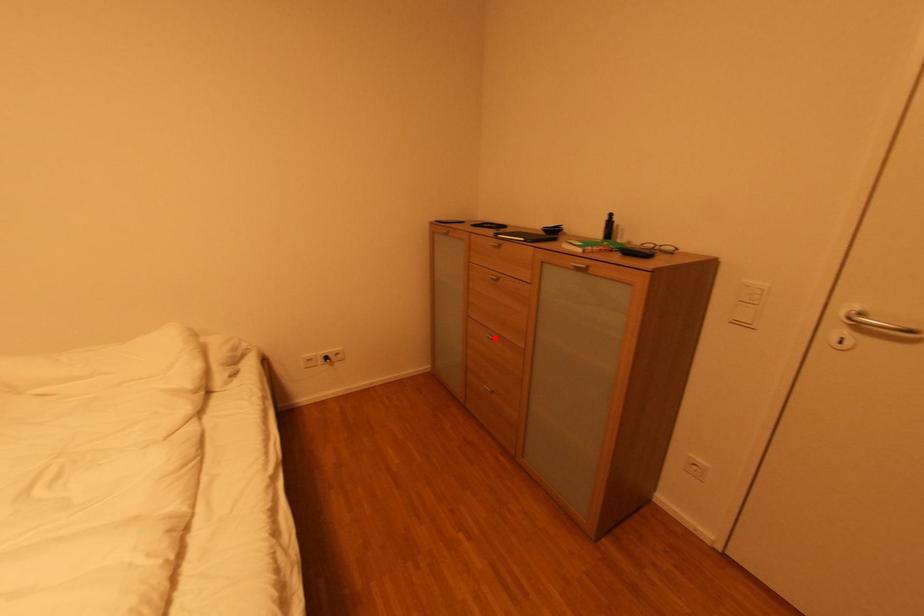
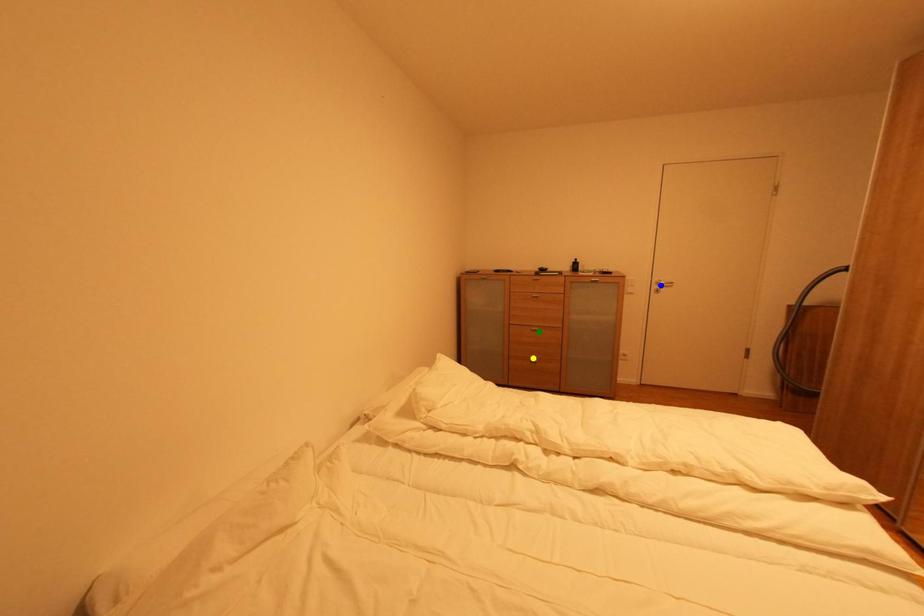
Question: I am providing you with two images of the same scene from different viewpoints. A red point is marked on the first image. You are given multiple points on the second image. Which mark in image 2 goes with the point in image 1?

Choices:
 (A) yellow point
 (B) blue point
 (C) green point

Answer: (C)